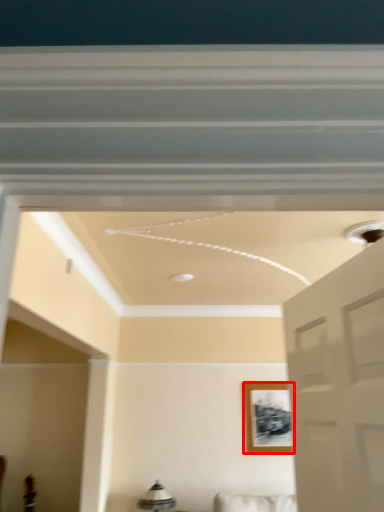
Question: From the image's perspective, considering the relative positions of picture frame (annotated by the red box) and lamp in the image provided, where is picture frame (annotated by the red box) located with respect to the staircase?

Choices:
 (A) below
 (B) above

Answer: (B)